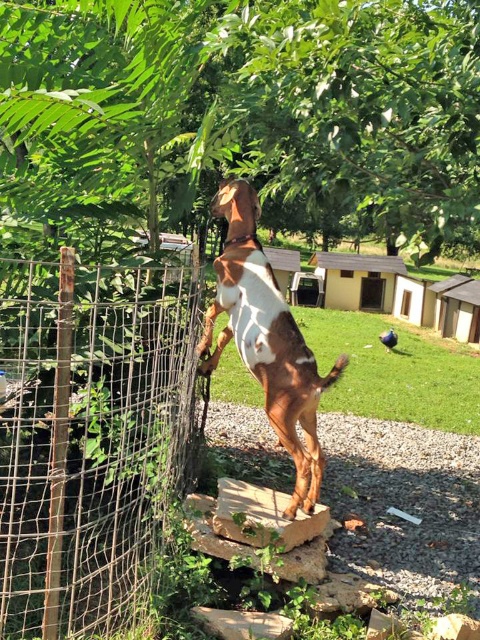
Does point (38, 390) lie behind point (283, 400)?

No, (38, 390) is closer to viewer.

Is point (100, 493) closer to camera compared to point (276, 368)?

Yes, point (100, 493) is closer to viewer.

Does point (36, 390) lie behind point (265, 321)?

No, it is in front of (265, 321).

Locate an element on the screen. Image resolution: width=480 pixels, height=640 pixels. wire mesh fence at center is located at coordinates (x=88, y=436).